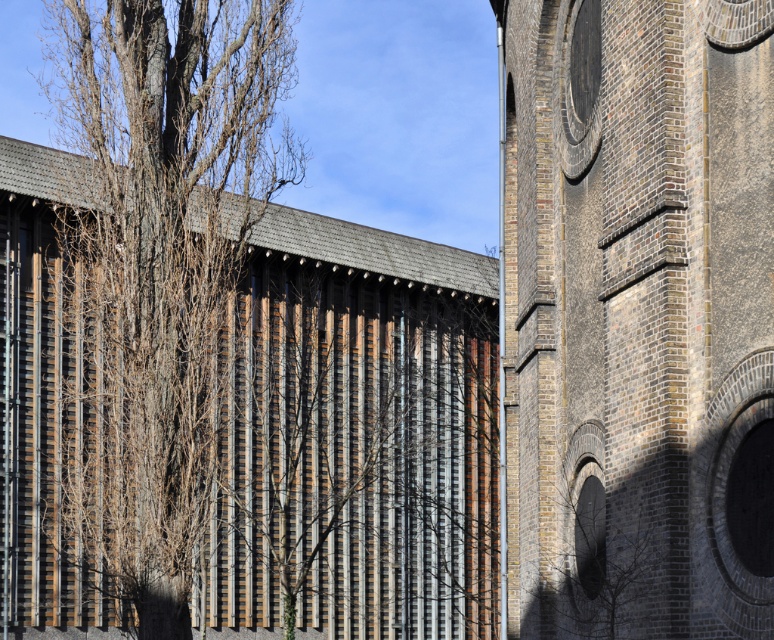
In the scene shown: You are standing in front of the modern building with vertical wooden slats and metallic panels. There is a point marked at coordinates (355, 436). Based on the image, can you determine which material this point is located on?

The point at (355, 436) is located on the wooden slats at center.